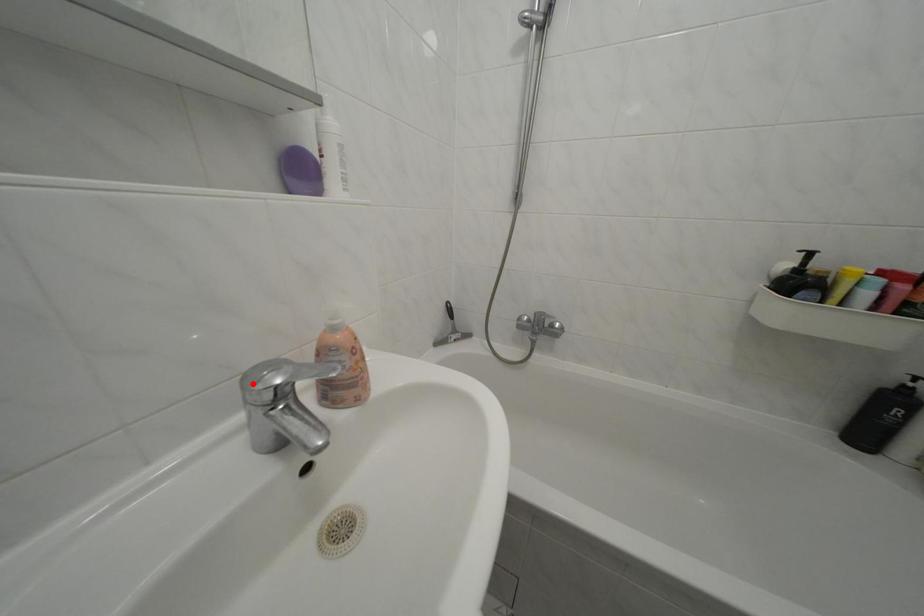
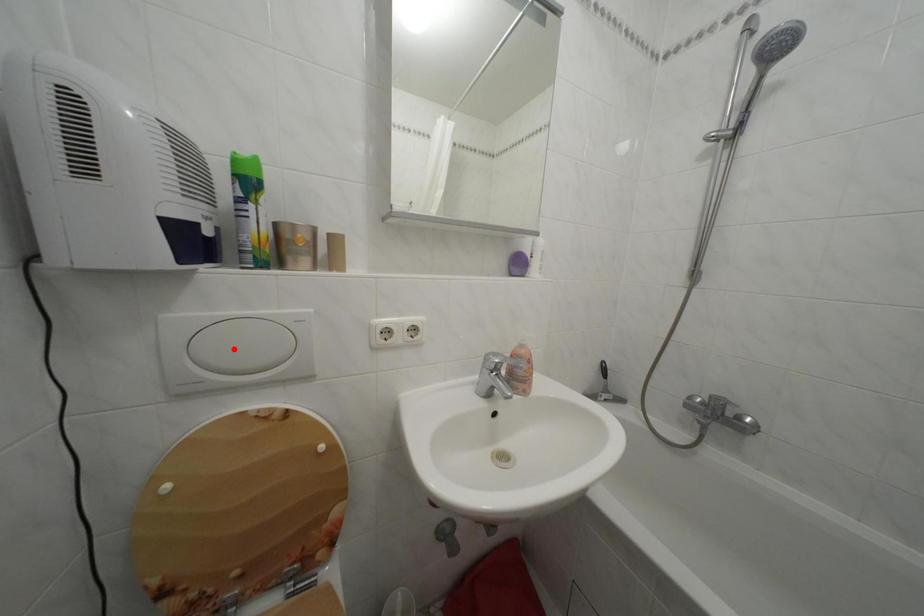
I am providing you with two images of the same scene from different viewpoints. A red point is marked on the first image and another point is marked on the second image. Is the marked point in image1 the same physical position as the marked point in image2?

No